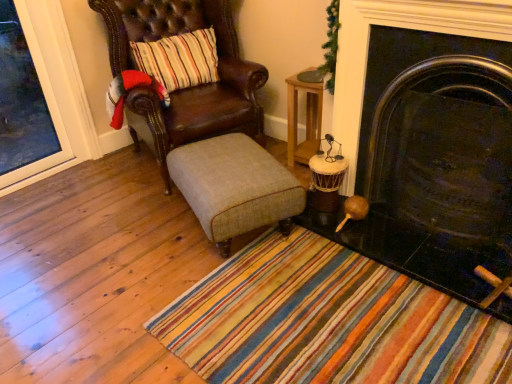
Question: Could wooden candle holder at lower right be considered to be inside black glossy fireplace at right?

Choices:
 (A) yes
 (B) no

Answer: (B)

Question: Is black glossy fireplace at right oriented towards wooden candle holder at lower right?

Choices:
 (A) no
 (B) yes

Answer: (A)

Question: Is black glossy fireplace at right wider than wooden candle holder at lower right?

Choices:
 (A) no
 (B) yes

Answer: (B)

Question: Is black glossy fireplace at right positioned before wooden candle holder at lower right?

Choices:
 (A) no
 (B) yes

Answer: (B)

Question: Is black glossy fireplace at right far away from wooden candle holder at lower right?

Choices:
 (A) no
 (B) yes

Answer: (A)

Question: From the image's perspective, is wooden table at upper right above or below black glossy fireplace at right?

Choices:
 (A) below
 (B) above

Answer: (B)

Question: Considering their positions, is wooden table at upper right located in front of or behind black glossy fireplace at right?

Choices:
 (A) behind
 (B) front

Answer: (A)

Question: In terms of height, does wooden table at upper right look taller or shorter compared to black glossy fireplace at right?

Choices:
 (A) short
 (B) tall

Answer: (A)

Question: From a real-world perspective, is wooden table at upper right positioned above or below black glossy fireplace at right?

Choices:
 (A) above
 (B) below

Answer: (B)

Question: Is point tap(232, 142) positioned closer to the camera than point tap(298, 152)?

Choices:
 (A) farther
 (B) closer

Answer: (B)

Question: Is beige fabric stool at center in front of or behind wooden table at upper right in the image?

Choices:
 (A) behind
 (B) front

Answer: (B)

Question: From a real-world perspective, is beige fabric stool at center positioned above or below wooden table at upper right?

Choices:
 (A) below
 (B) above

Answer: (A)

Question: Which is correct: beige fabric stool at center is inside wooden table at upper right, or outside of it?

Choices:
 (A) inside
 (B) outside

Answer: (B)

Question: From the image's perspective, is black glossy fireplace at right positioned above or below wooden candle holder at lower right?

Choices:
 (A) below
 (B) above

Answer: (B)

Question: Is black glossy fireplace at right taller or shorter than wooden candle holder at lower right?

Choices:
 (A) short
 (B) tall

Answer: (B)